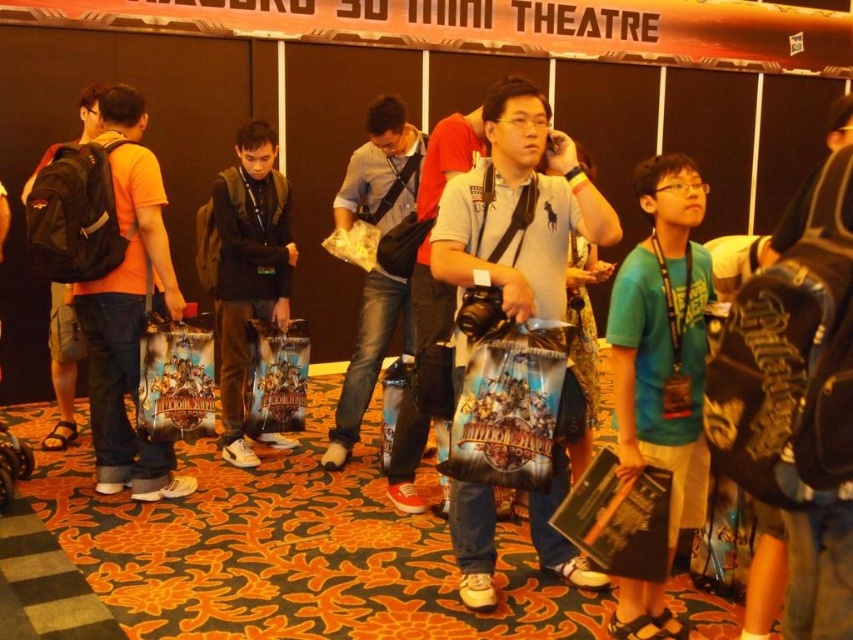
Is point (125, 323) closer to viewer compared to point (244, 376)?

Yes, it is.

Is orange matte backpack at left above black matte backpack at center?

No, orange matte backpack at left is not above black matte backpack at center.

Between point (126, 138) and point (274, 308), which one is positioned behind?

The point (274, 308) is more distant.

This screenshot has height=640, width=853. What are the coordinates of `orange matte backpack at left` in the screenshot? It's located at (128, 308).

Does green matte t-shirt at center lie in front of gray cotton polo shirt at center?

Yes, it is in front of gray cotton polo shirt at center.

Is point (665, 621) closer to viewer compared to point (456, 184)?

That is True.

Find the location of `green matte t-shirt at center`. green matte t-shirt at center is located at coordinates (663, 340).

I want to click on green matte t-shirt at center, so click(663, 340).

Describe the element at coordinates (514, 204) in the screenshot. I see `gray cotton polo shirt at center` at that location.

Is point (540, 557) positioned behind point (350, 388)?

No, (540, 557) is in front of (350, 388).

The width and height of the screenshot is (853, 640). What do you see at coordinates (514, 204) in the screenshot? I see `gray cotton polo shirt at center` at bounding box center [514, 204].

Locate an element on the screen. The height and width of the screenshot is (640, 853). gray cotton polo shirt at center is located at coordinates (514, 204).